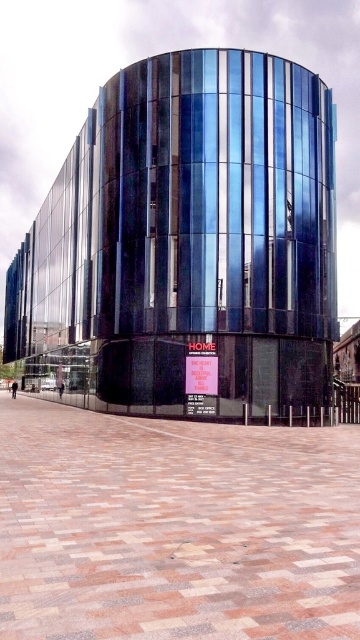
Question: Can you confirm if paved brick plaza at center is wider than red plastic sign at center?

Choices:
 (A) no
 (B) yes

Answer: (B)

Question: Estimate the real-world distances between objects in this image. Which object is closer to the red plastic sign at center?

Choices:
 (A) paved brick plaza at center
 (B) polished concrete plaza at center

Answer: (A)

Question: Which object is positioned closest to the polished concrete plaza at center?

Choices:
 (A) paved brick plaza at center
 (B) red plastic sign at center

Answer: (B)

Question: Is polished concrete plaza at center closer to the viewer compared to red plastic sign at center?

Choices:
 (A) no
 (B) yes

Answer: (B)

Question: Which point is closer to the camera taking this photo?

Choices:
 (A) (186, 356)
 (B) (227, 525)

Answer: (B)

Question: Considering the relative positions of polished concrete plaza at center and red plastic sign at center in the image provided, where is polished concrete plaza at center located with respect to red plastic sign at center?

Choices:
 (A) below
 (B) above

Answer: (B)